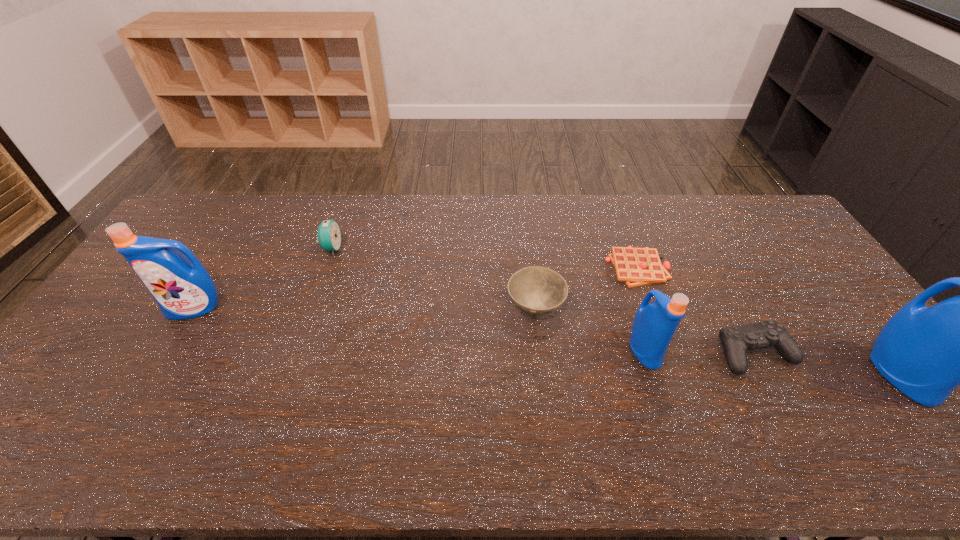
Find the location of a particular element. vacant space that's between the second tallest detergent and the sixth tallest object is located at coordinates (475, 330).

Find the location of `free space between the tallest object and the second tallest detergent`. free space between the tallest object and the second tallest detergent is located at coordinates (547, 341).

Locate an element on the screen. free space between the sixth shortest object and the rightmost detergent is located at coordinates (547, 341).

I want to click on vacant area that lies between the waffle and the second object from left to right, so click(x=485, y=258).

Image resolution: width=960 pixels, height=540 pixels. What are the coordinates of `vacant area between the third object from left to right and the sixth shortest object` in the screenshot? It's located at (365, 308).

I want to click on object that is the fifth nearest to the control, so click(329, 234).

Identify which object is located as the fourth nearest to the shortest object. Please provide its 2D coordinates. Your answer should be formatted as a tuple, i.e. [(x, y)], where the tuple contains the x and y coordinates of a point satisfying the conditions above.

[(926, 353)]

Find the location of a particular element. The image size is (960, 540). detergent that can be found as the second closest to the farthest detergent is located at coordinates (926, 353).

This screenshot has width=960, height=540. Find the location of `detergent object that ranks as the second closest to the second object from left to right`. detergent object that ranks as the second closest to the second object from left to right is located at coordinates (654, 324).

Locate an element on the screen. free spot that satisfies the following two spatial constraints: 1. on the label of the sixth tallest object; 2. on the right side of the second shortest detergent is located at coordinates (168, 353).